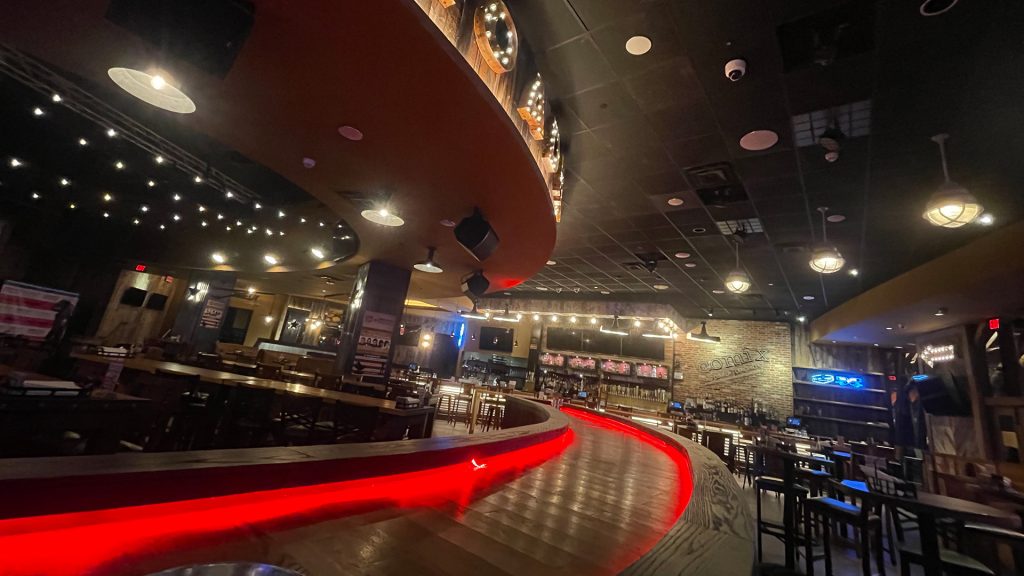
Locate an element on the screen. The image size is (1024, 576). light is located at coordinates (735, 282).